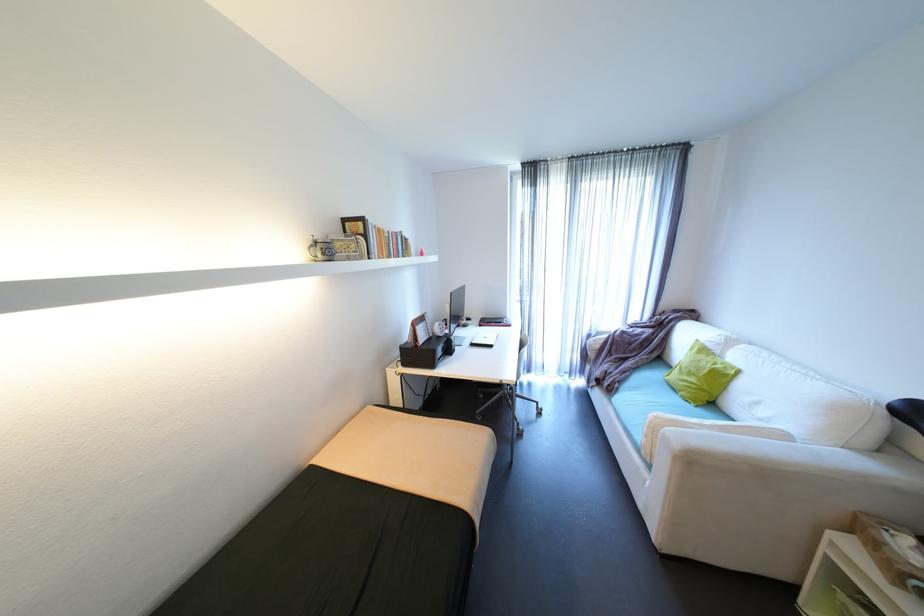
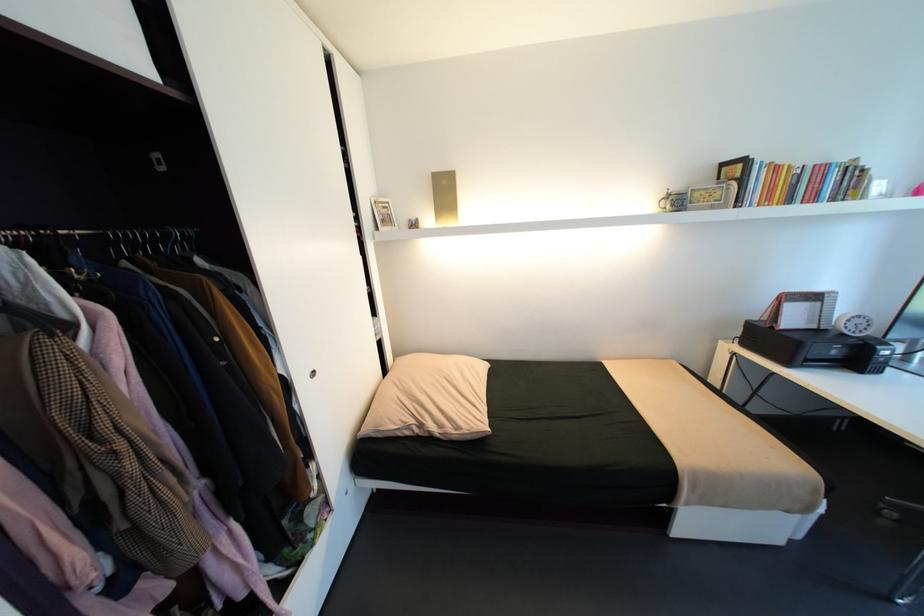
Find the pixel in the second image that matches (x=423, y=346) in the first image.

(779, 328)